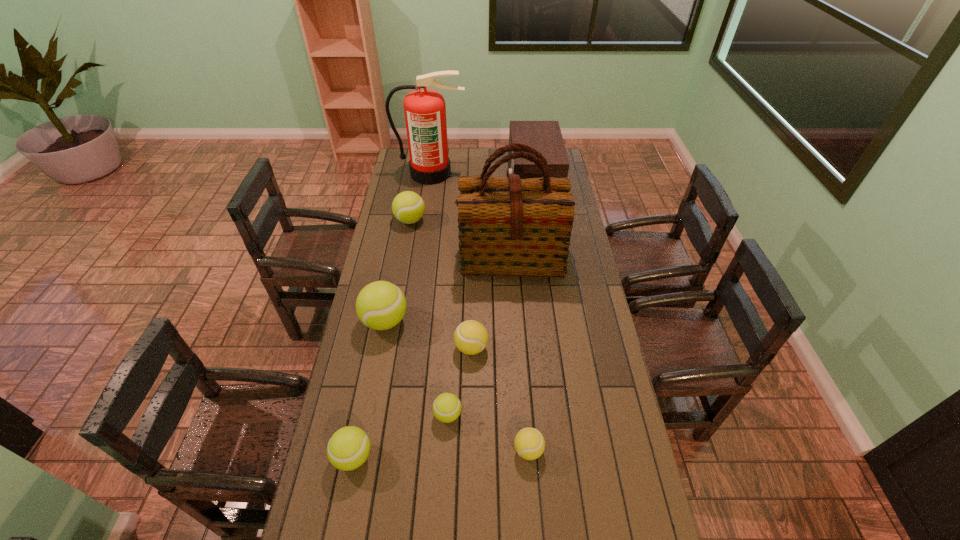
The image size is (960, 540). Find the location of `object present at the far left corner`. object present at the far left corner is located at coordinates (425, 111).

At what (x,y) coordinates should I click in order to perform the action: click on object that is at the far right corner. Please return your answer as a coordinate pair (x, y). Looking at the image, I should click on (544, 136).

The height and width of the screenshot is (540, 960). Identify the location of vacant space at the left edge. (390, 348).

You are a GUI agent. You are given a task and a screenshot of the screen. Output one action in this format:
    pyautogui.click(x=<x>, y=<y>)
    Task: Click on the vacant space at the right edge of the desktop
    This screenshot has width=960, height=540.
    Given the screenshot: What is the action you would take?
    pyautogui.click(x=593, y=336)

Identify the location of free space between the nearer yellow tennis ball and the radio receiver. (530, 318).

In order to click on vacant point located between the sixth nearest object and the farther yellow tennis ball in this screenshot , I will do `click(492, 302)`.

The width and height of the screenshot is (960, 540). Identify the location of blank region between the shopping bag and the second smallest green tennis ball. (432, 356).

The height and width of the screenshot is (540, 960). I want to click on unoccupied position between the smaller yellow tennis ball and the farther yellow tennis ball, so click(x=500, y=399).

At what (x,y) coordinates should I click in order to perform the action: click on vacant area that lies between the seventh shortest object and the biggest green tennis ball. Please return your answer as a coordinate pair (x, y). This screenshot has height=540, width=960. Looking at the image, I should click on (458, 253).

Image resolution: width=960 pixels, height=540 pixels. I want to click on free space between the third biggest green tennis ball and the seventh nearest object, so click(382, 339).